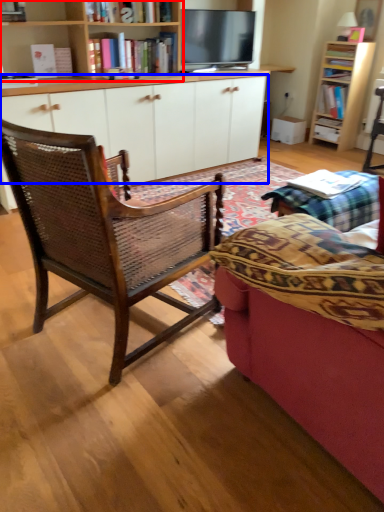
Question: Among these objects, which one is farthest to the camera, bookcase (highlighted by a red box) or cabinetry (highlighted by a blue box)?

Choices:
 (A) bookcase
 (B) cabinetry

Answer: (B)